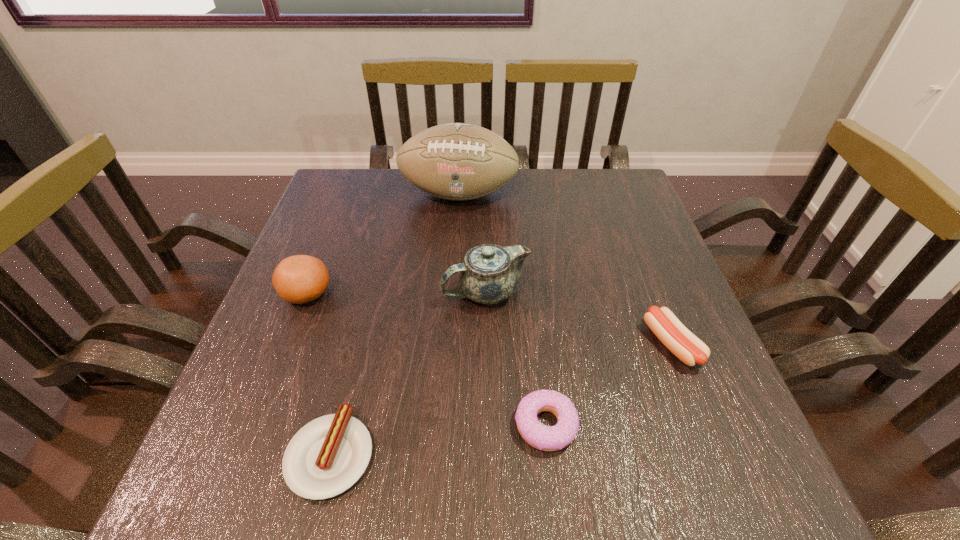
Find the location of a particular element. the farthest object is located at coordinates (455, 161).

I want to click on football (American), so click(455, 161).

This screenshot has width=960, height=540. I want to click on chinaware, so click(x=489, y=274).

The height and width of the screenshot is (540, 960). I want to click on the leftmost object, so click(x=298, y=279).

I want to click on clementine, so click(298, 279).

The width and height of the screenshot is (960, 540). I want to click on the taller sausage, so click(x=688, y=348).

The image size is (960, 540). Identify the location of the right sausage. (688, 348).

Locate an element on the screen. doughnut is located at coordinates (546, 438).

You are a GUI agent. You are given a task and a screenshot of the screen. Output one action in this format:
    pyautogui.click(x=<x>, y=<y>)
    Task: Click on the nearer sausage
    The width and height of the screenshot is (960, 540).
    Given the screenshot: What is the action you would take?
    pyautogui.click(x=327, y=456)

Locate an element on the screen. This screenshot has height=540, width=960. the shortest object is located at coordinates (327, 456).